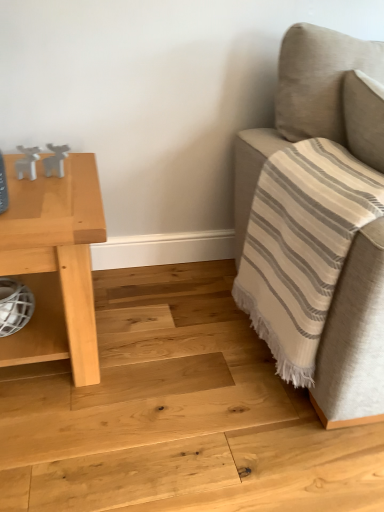
Find the location of a particular element. This screenshot has width=384, height=512. free space in front of white matte deer at left, positioned as the first toy in left-to-right order is located at coordinates (26, 201).